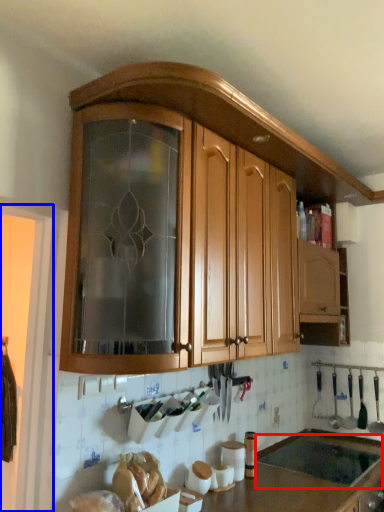
Question: Which object appears closest to the camera in this image, sink (highlighted by a red box) or screen door (highlighted by a blue box)?

Choices:
 (A) sink
 (B) screen door

Answer: (B)